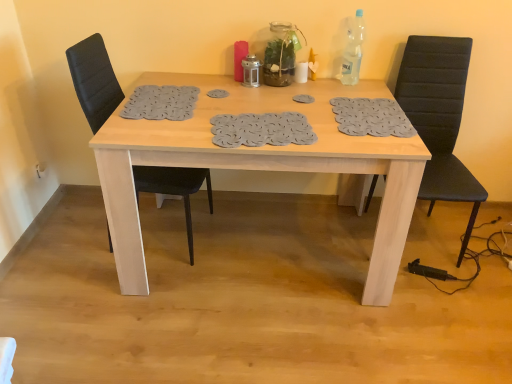
Locate an element on the screen. free space in front of black leather chair at right, arranged as the 2th chair when viewed from the left is located at coordinates (441, 308).